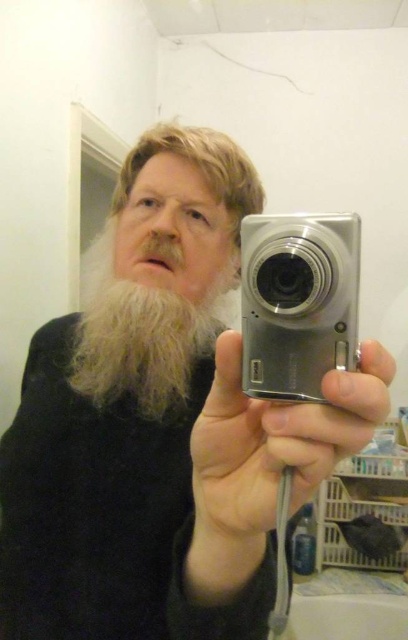
Which is more to the left, silver metallic camera at center or light brown fuzzy beard at center?

light brown fuzzy beard at center is more to the left.

Is point (343, 248) closer to viewer compared to point (148, 340)?

That is True.

Describe the element at coordinates (297, 301) in the screenshot. I see `silver metallic camera at center` at that location.

The height and width of the screenshot is (640, 408). What are the coordinates of `silver metallic camera at center` in the screenshot? It's located at [x=297, y=301].